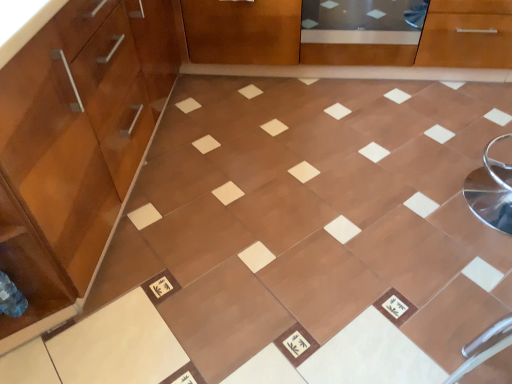
The image size is (512, 384). Describe the element at coordinates (316, 228) in the screenshot. I see `brown glossy tile at center` at that location.

What is the approximate height of brown glossy tile at center?

brown glossy tile at center is 2.30 inches in height.

What do you see at coordinates (76, 146) in the screenshot? The width and height of the screenshot is (512, 384). I see `matte wood cabinetry at left` at bounding box center [76, 146].

Locate an element on the screen. brown glossy tile at center is located at coordinates (316, 228).

Is matte wood cabinetry at left positioned before transparent glass screen door at upper center?

Yes, it is in front of transparent glass screen door at upper center.

Can you confirm if matte wood cabinetry at left is positioned to the right of transparent glass screen door at upper center?

In fact, matte wood cabinetry at left is to the left of transparent glass screen door at upper center.

In the scene shown: Is matte wood cabinetry at left inside the boundaries of transparent glass screen door at upper center, or outside?

matte wood cabinetry at left is not enclosed by transparent glass screen door at upper center.

Is matte wood cabinetry at left taller than transparent glass screen door at upper center?

Indeed, matte wood cabinetry at left has a greater height compared to transparent glass screen door at upper center.

In the image, there is a transparent glass screen door at upper center. What are the coordinates of `ceramic tile below it (from a real-world perspective)` in the screenshot? It's located at (316, 228).

Considering the relative sizes of transparent glass screen door at upper center and brown glossy tile at center in the image provided, is transparent glass screen door at upper center shorter than brown glossy tile at center?

Incorrect, the height of transparent glass screen door at upper center does not fall short of that of brown glossy tile at center.

Does transparent glass screen door at upper center have a smaller size compared to brown glossy tile at center?

Yes.

Which is more to the left, transparent glass screen door at upper center or brown glossy tile at center?

Positioned to the left is brown glossy tile at center.

Looking at this image, can you confirm if brown glossy tile at center is smaller than transparent glass screen door at upper center?

No.

From a real-world perspective, does brown glossy tile at center stand above transparent glass screen door at upper center?

Actually, brown glossy tile at center is physically below transparent glass screen door at upper center in the real world.

Where is `screen door behind the brown glossy tile at center`? The width and height of the screenshot is (512, 384). screen door behind the brown glossy tile at center is located at coordinates (361, 32).

Between brown glossy tile at center and transparent glass screen door at upper center, which one appears on the right side from the viewer's perspective?

Positioned to the right is transparent glass screen door at upper center.

Does transparent glass screen door at upper center lie behind matte wood cabinetry at left?

Yes, it is behind matte wood cabinetry at left.

Does transparent glass screen door at upper center have a larger size compared to matte wood cabinetry at left?

Actually, transparent glass screen door at upper center might be smaller than matte wood cabinetry at left.

Does point (331, 38) come in front of point (2, 139)?

No, (331, 38) is behind (2, 139).

Considering the sizes of objects transparent glass screen door at upper center and matte wood cabinetry at left in the image provided, who is wider, transparent glass screen door at upper center or matte wood cabinetry at left?

Wider between the two is matte wood cabinetry at left.

This screenshot has width=512, height=384. Identify the location of ceramic tile that is under the matte wood cabinetry at left (from a real-world perspective). (316, 228).

Is matte wood cabinetry at left facing towards brown glossy tile at center?

Yes, matte wood cabinetry at left faces towards brown glossy tile at center.

Which of these two, matte wood cabinetry at left or brown glossy tile at center, stands taller?

Standing taller between the two is matte wood cabinetry at left.

What's the angular difference between matte wood cabinetry at left and brown glossy tile at center's facing directions?

1.33 degrees separate the facing orientations of matte wood cabinetry at left and brown glossy tile at center.

Does brown glossy tile at center have a larger size compared to matte wood cabinetry at left?

No.

Is brown glossy tile at center further to camera compared to matte wood cabinetry at left?

Yes, the depth of brown glossy tile at center is greater than that of matte wood cabinetry at left.

At what (x,y) coordinates should I click in order to perform the action: click on screen door located underneath the matte wood cabinetry at left (from a real-world perspective). Please return your answer as a coordinate pair (x, y). Looking at the image, I should click on (361, 32).

Where is `ceramic tile on the left of transparent glass screen door at upper center`? ceramic tile on the left of transparent glass screen door at upper center is located at coordinates (316, 228).

Considering their positions, is brown glossy tile at center positioned closer to matte wood cabinetry at left than transparent glass screen door at upper center?

brown glossy tile at center.

Looking at this image, when comparing their distances from brown glossy tile at center, does transparent glass screen door at upper center or matte wood cabinetry at left seem closer?

Among the two, matte wood cabinetry at left is located nearer to brown glossy tile at center.

Based on their spatial positions, is matte wood cabinetry at left or brown glossy tile at center further from transparent glass screen door at upper center?

Among the two, matte wood cabinetry at left is located further to transparent glass screen door at upper center.

When comparing their distances from brown glossy tile at center, does matte wood cabinetry at left or transparent glass screen door at upper center seem closer?

matte wood cabinetry at left.

Which object lies further to the anchor point transparent glass screen door at upper center, brown glossy tile at center or matte wood cabinetry at left?

matte wood cabinetry at left is positioned further to the anchor transparent glass screen door at upper center.

When comparing their distances from matte wood cabinetry at left, does transparent glass screen door at upper center or brown glossy tile at center seem further?

Among the two, transparent glass screen door at upper center is located further to matte wood cabinetry at left.

I want to click on ceramic tile between matte wood cabinetry at left and transparent glass screen door at upper center from left to right, so click(x=316, y=228).